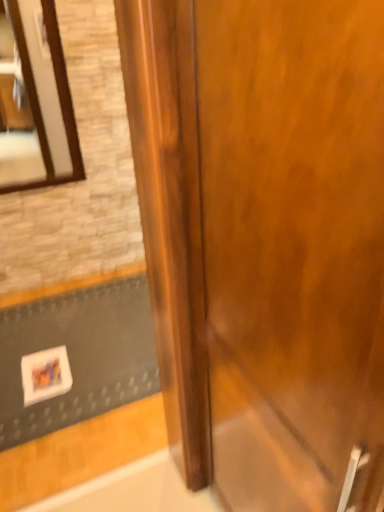
Question: Is white matte doormat at lower left smaller than glossy wood door at center?

Choices:
 (A) yes
 (B) no

Answer: (A)

Question: Is white matte doormat at lower left in front of glossy wood door at center?

Choices:
 (A) no
 (B) yes

Answer: (A)

Question: From a real-world perspective, is white matte doormat at lower left physically below glossy wood door at center?

Choices:
 (A) yes
 (B) no

Answer: (A)

Question: Does white matte doormat at lower left appear on the left side of glossy wood door at center?

Choices:
 (A) no
 (B) yes

Answer: (B)

Question: Is white matte doormat at lower left positioned beyond the bounds of glossy wood door at center?

Choices:
 (A) yes
 (B) no

Answer: (A)

Question: Is white matte doormat at lower left shorter than glossy wood door at center?

Choices:
 (A) no
 (B) yes

Answer: (B)

Question: Is glossy wood door at center facing away from white matte doormat at lower left?

Choices:
 (A) no
 (B) yes

Answer: (A)

Question: Is glossy wood door at center positioned before white matte doormat at lower left?

Choices:
 (A) yes
 (B) no

Answer: (A)

Question: Is the position of glossy wood door at center more distant than that of white matte doormat at lower left?

Choices:
 (A) yes
 (B) no

Answer: (B)

Question: Can you confirm if glossy wood door at center is positioned to the left of white matte doormat at lower left?

Choices:
 (A) no
 (B) yes

Answer: (A)

Question: Considering the relative sizes of glossy wood door at center and white matte doormat at lower left in the image provided, is glossy wood door at center shorter than white matte doormat at lower left?

Choices:
 (A) no
 (B) yes

Answer: (A)

Question: Can you confirm if glossy wood door at center is thinner than white matte doormat at lower left?

Choices:
 (A) no
 (B) yes

Answer: (B)

Question: Can white matte doormat at lower left be found inside wooden-framed mirror at upper left?

Choices:
 (A) no
 (B) yes

Answer: (A)